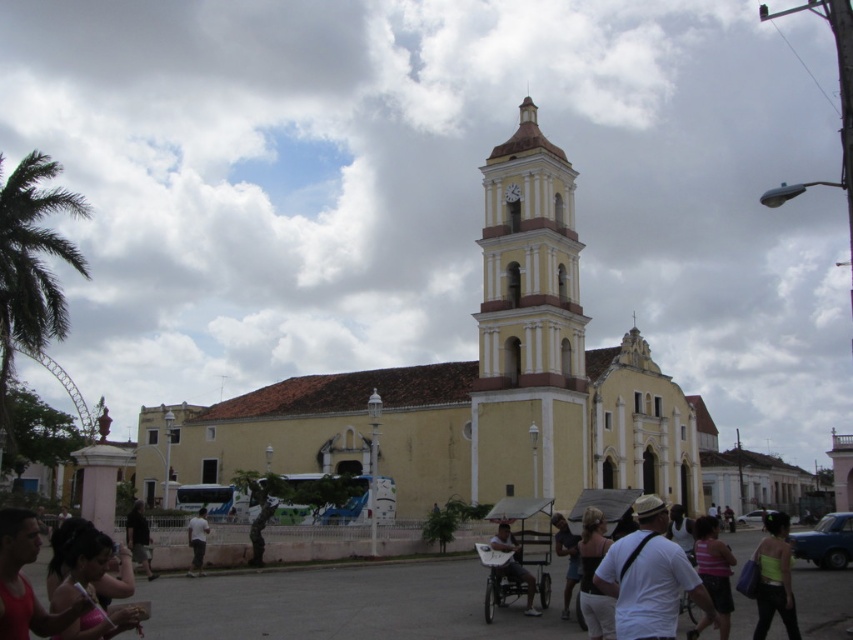
You are standing at the point marked as point (x=471, y=385) in the image. Which object are you standing on?

You are standing on the yellow matte church at center.

You are standing at the camera position and want to take a photo of the yellow matte church at center. If your camera has a maximum focus range of 70 meters, will you be able to focus on the church?

The yellow matte church at center and camera are 70.81 meters apart. Since the distance exceeds the camera maximum focus range of 70 meters, the camera cannot focus on the church.